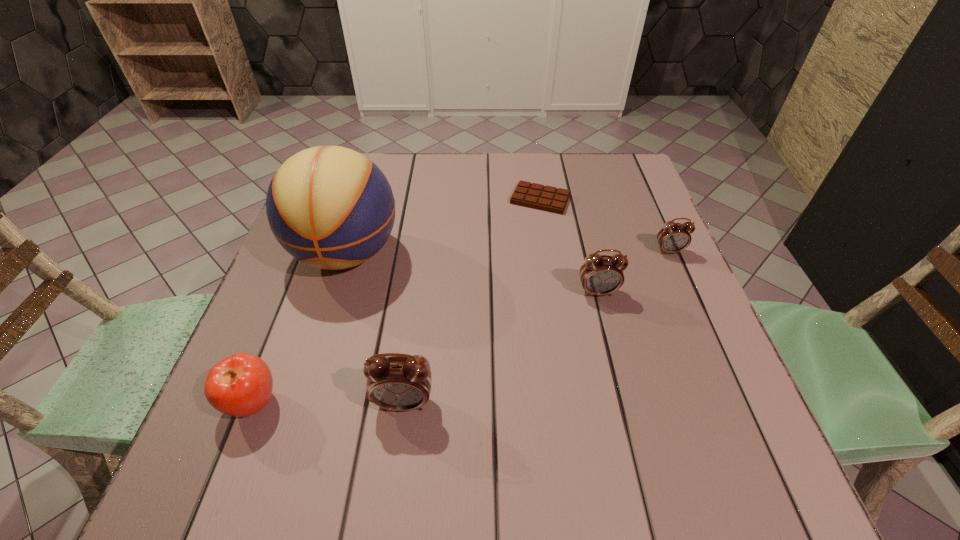
Where is `the leftmost alarm clock`? Image resolution: width=960 pixels, height=540 pixels. the leftmost alarm clock is located at coordinates (401, 383).

At what (x,y) coordinates should I click in order to perform the action: click on the tallest alarm clock. Please return your answer as a coordinate pair (x, y). Image resolution: width=960 pixels, height=540 pixels. Looking at the image, I should click on (401, 383).

Locate an element on the screen. The height and width of the screenshot is (540, 960). the second farthest alarm clock is located at coordinates (600, 275).

Where is `the second alarm clock from right to left`? The height and width of the screenshot is (540, 960). the second alarm clock from right to left is located at coordinates (600, 275).

I want to click on the rightmost object, so click(674, 237).

The width and height of the screenshot is (960, 540). Identify the location of the rightmost alarm clock. (674, 237).

You are a GUI agent. You are given a task and a screenshot of the screen. Output one action in this format:
    pyautogui.click(x=<x>, y=<y>)
    Task: Click on the farthest object
    Image resolution: width=960 pixels, height=540 pixels.
    Given the screenshot: What is the action you would take?
    pyautogui.click(x=537, y=196)

Find the location of a particular element. The height and width of the screenshot is (540, 960). the shortest object is located at coordinates (537, 196).

The width and height of the screenshot is (960, 540). What are the coordinates of `the tallest object` in the screenshot? It's located at (330, 207).

Image resolution: width=960 pixels, height=540 pixels. I want to click on apple, so click(x=240, y=385).